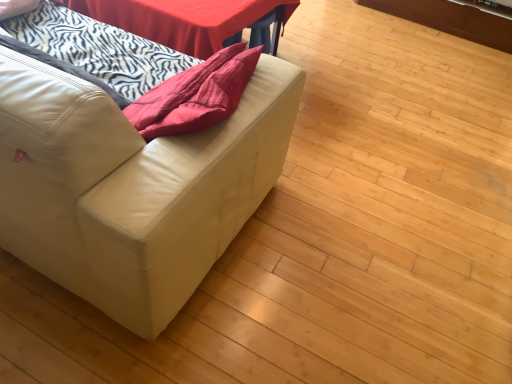
Question: Does point (224, 18) appear closer or farther from the camera than point (270, 92)?

Choices:
 (A) farther
 (B) closer

Answer: (A)

Question: In terms of width, does smooth red table at upper center look wider or thinner when compared to white leather couch at left?

Choices:
 (A) thin
 (B) wide

Answer: (A)

Question: Which of these objects is positioned closest to the white zebra-patterned blanket at left?

Choices:
 (A) white leather couch at left
 (B) smooth red table at upper center

Answer: (B)

Question: Based on their relative distances, which object is farther from the white zebra-patterned blanket at left?

Choices:
 (A) smooth red table at upper center
 (B) white leather couch at left

Answer: (B)